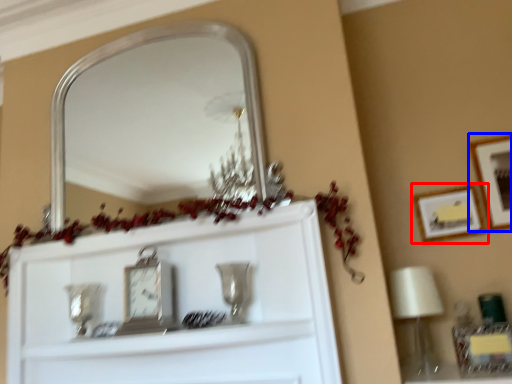
Question: Which object is further to the camera taking this photo, picture frame (highlighted by a red box) or picture frame (highlighted by a blue box)?

Choices:
 (A) picture frame
 (B) picture frame

Answer: (A)